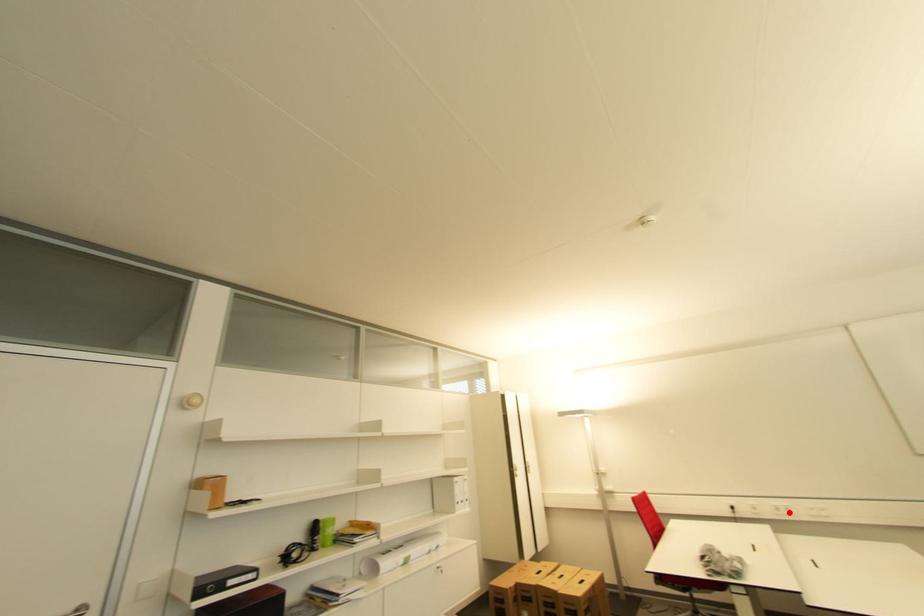
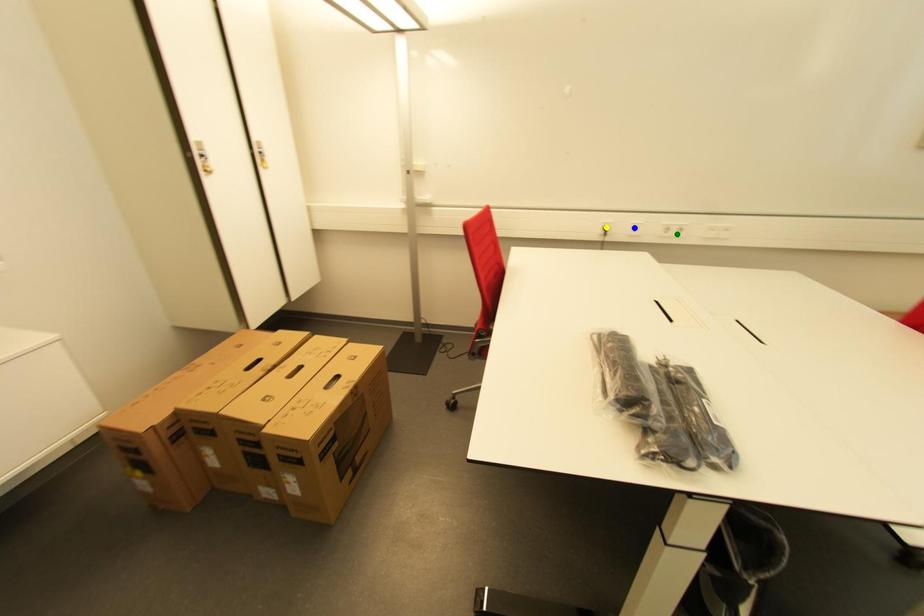
Question: I am providing you with two images of the same scene from different viewpoints. A red point is marked on the first image. You are given multiple points on the second image. Which spot in image 2 lines up with the point in image 1?

Choices:
 (A) green point
 (B) blue point
 (C) yellow point

Answer: (A)